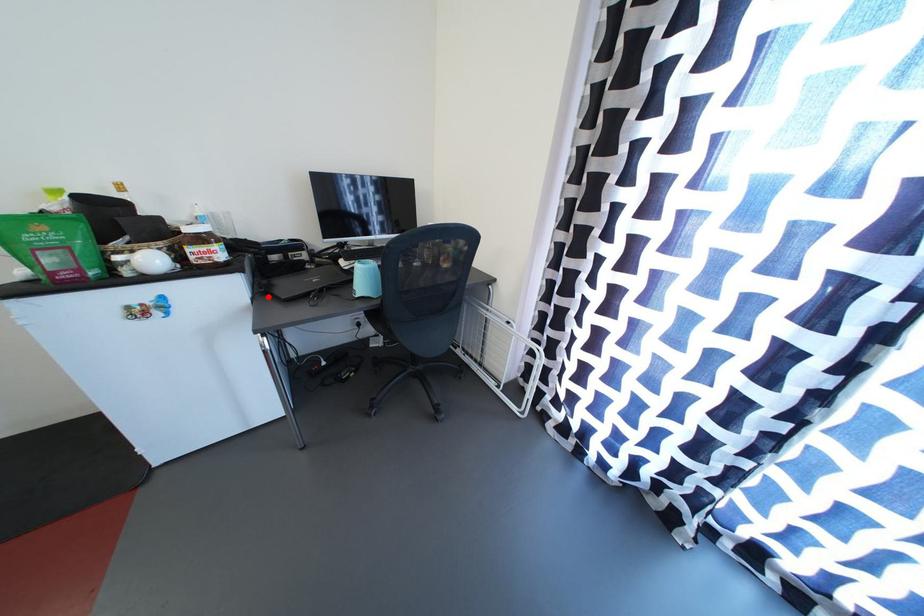
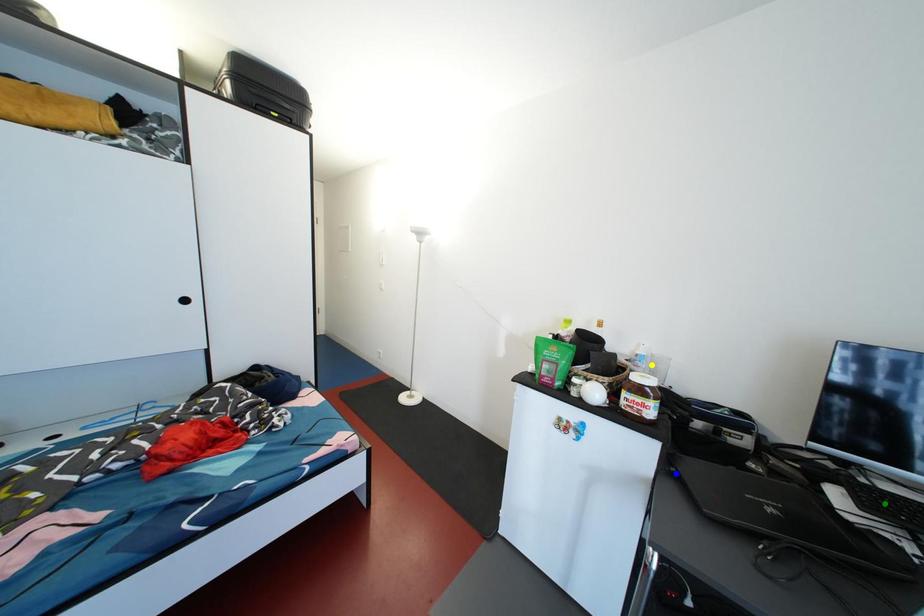
Question: I am providing you with two images of the same scene from different viewpoints. A red point is marked on the first image. You are given multiple points on the second image. Can you choose the point in image 2 that corresponds to the point in image 1?

Choices:
 (A) yellow point
 (B) green point
 (C) blue point

Answer: (C)